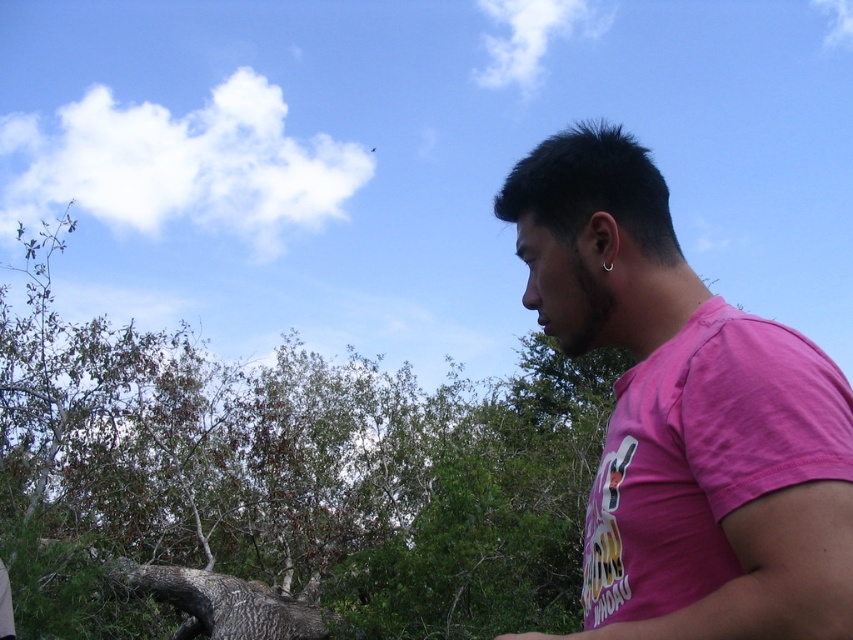
Question: Which of the following is the closest to the observer?

Choices:
 (A) green leafy tree at center
 (B) pink cotton shirt at right

Answer: (B)

Question: Can you confirm if green leafy tree at center is thinner than pink cotton shirt at right?

Choices:
 (A) no
 (B) yes

Answer: (A)

Question: Can you confirm if green leafy tree at center is positioned to the left of pink cotton shirt at right?

Choices:
 (A) yes
 (B) no

Answer: (A)

Question: In this image, where is green leafy tree at center located relative to pink cotton shirt at right?

Choices:
 (A) right
 (B) left

Answer: (B)